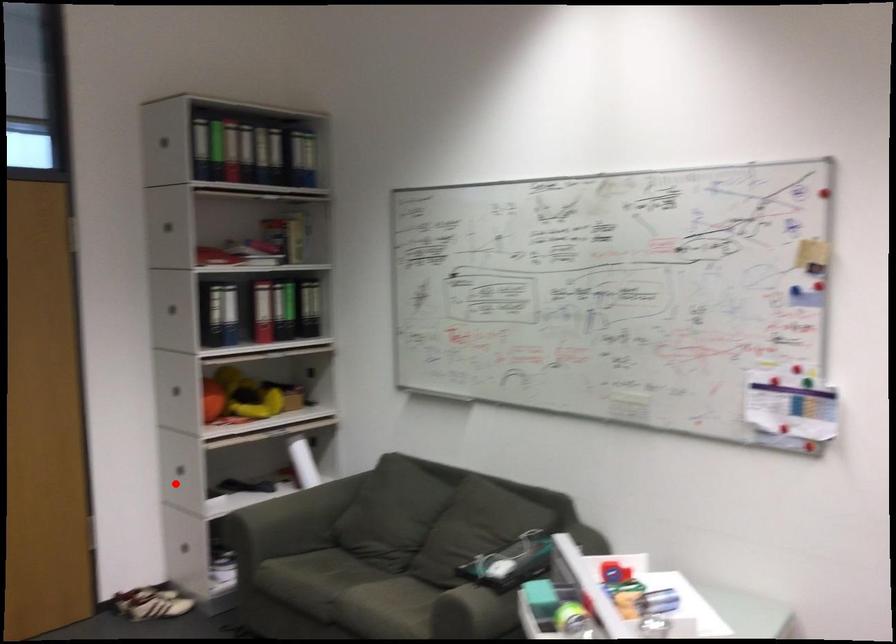
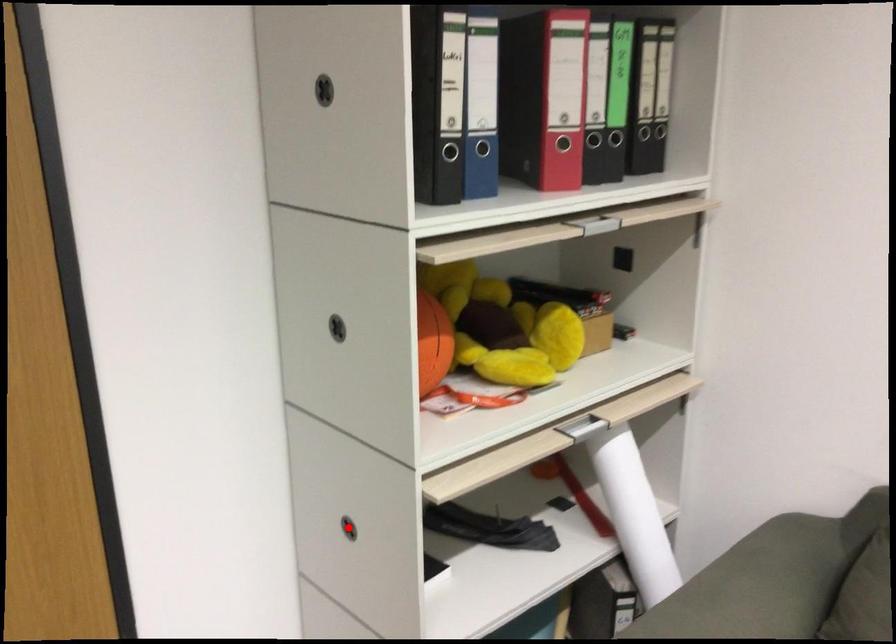
I am providing you with two images of the same scene from different viewpoints. A red point is marked on the first image and another point is marked on the second image. Does the point marked in image1 correspond to the same location as the one in image2?

Yes